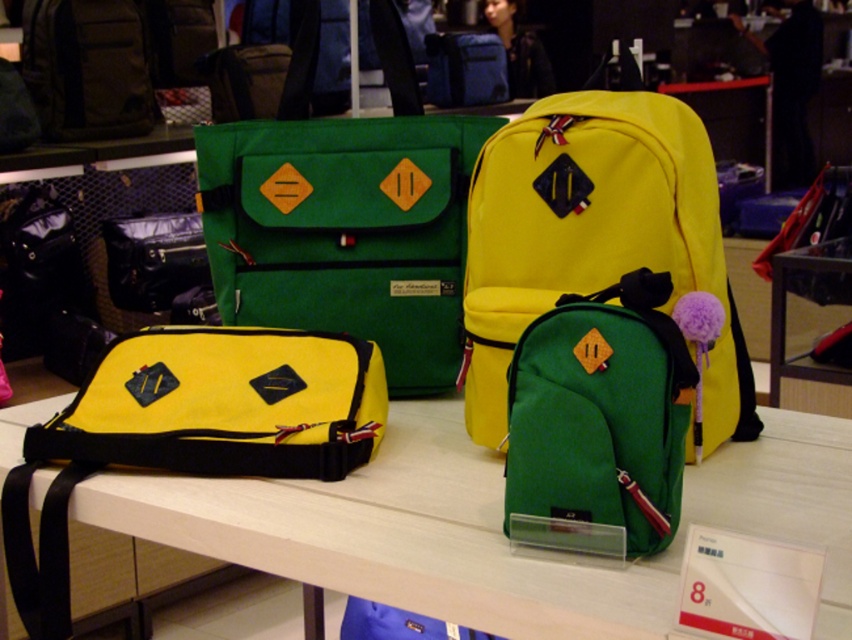
You are standing in front of the table with backpacks. There are two points marked on the table. The first point is at coordinate point (521, 132) and the second is at point (37, 102). Which point is closer to you?

Point (521, 132) is closer to the viewer than point (37, 102).

You are a store employee who needs to place a new backpack that is 2 meters long on the table. The new backpack must be placed between the matte yellow fabric bag at upper left and the matte black backpack at upper left. Is there enough space between them to fit the new backpack?

The distance between the matte yellow fabric bag at upper left and the matte black backpack at upper left is 1.79 meters. Since the new backpack is 2 meters long, which is longer than the available space, it won

Which backpack is positioned at the coordinates point (594,240)?

The green felt backpack at center is positioned at point (594,240).